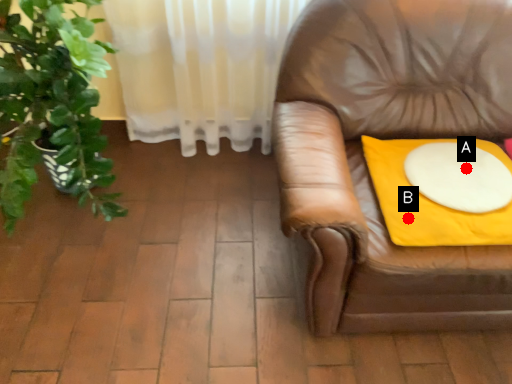
Question: Two points are circled on the image, labeled by A and B beside each circle. Which point is closer to the camera?

Choices:
 (A) A is closer
 (B) B is closer

Answer: (B)